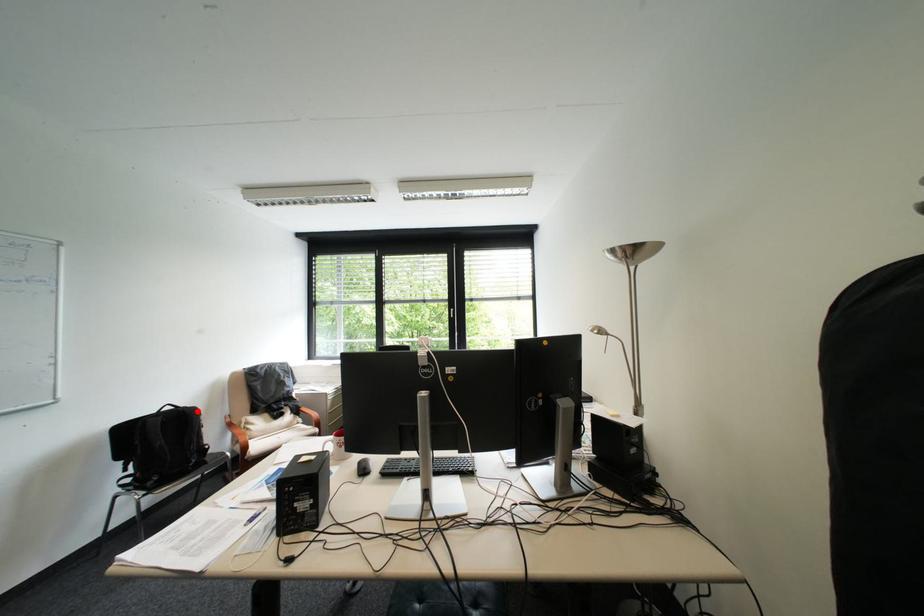
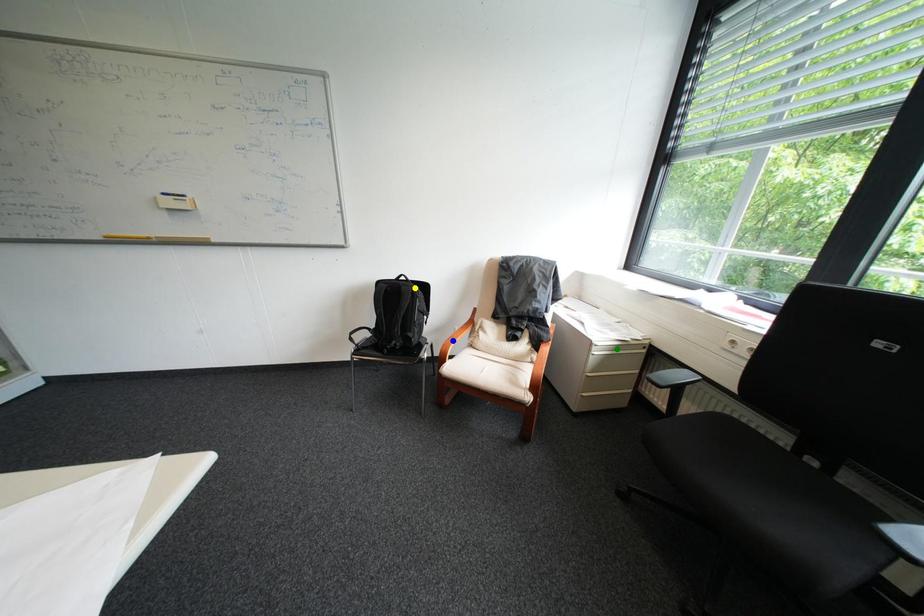
Question: I am providing you with two images of the same scene from different viewpoints. A red point is marked on the first image. You are given multiple points on the second image. Which point in image 2 represents the same 3d spot as the red point in image 1?

Choices:
 (A) blue point
 (B) yellow point
 (C) green point

Answer: (B)